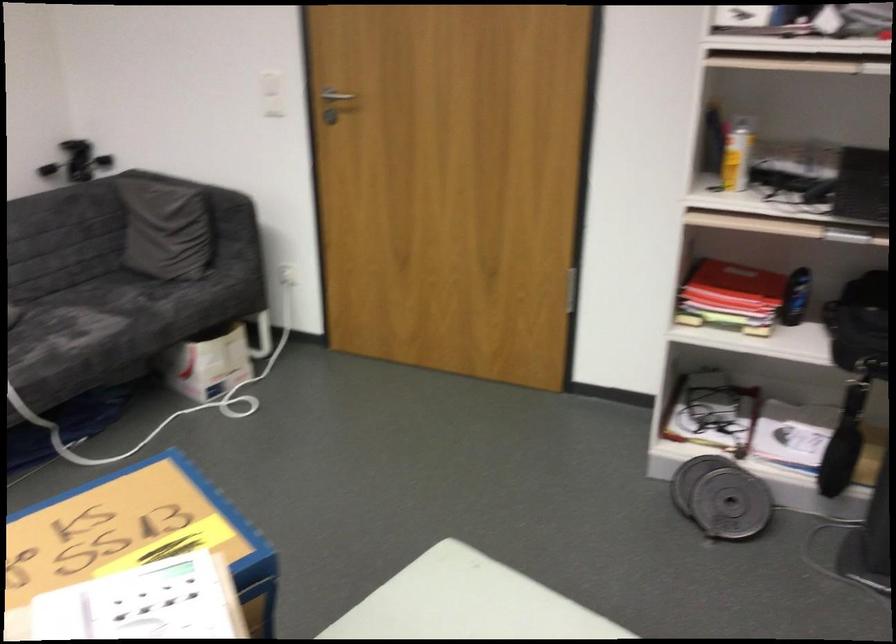
What do you see at coordinates (209, 194) in the screenshot? This screenshot has width=896, height=644. I see `a sofa armrest` at bounding box center [209, 194].